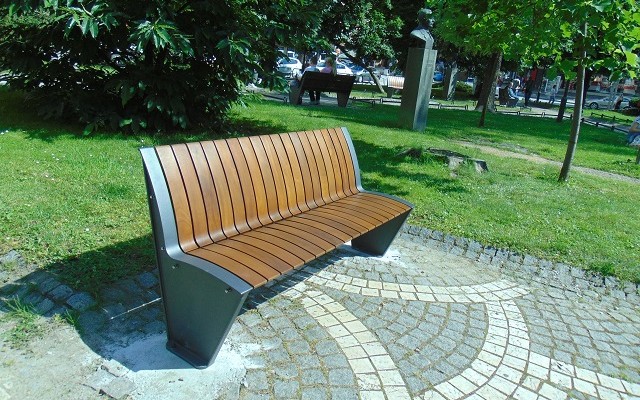
The image size is (640, 400). What are the coordinates of `chair` in the screenshot? It's located at (256, 219).